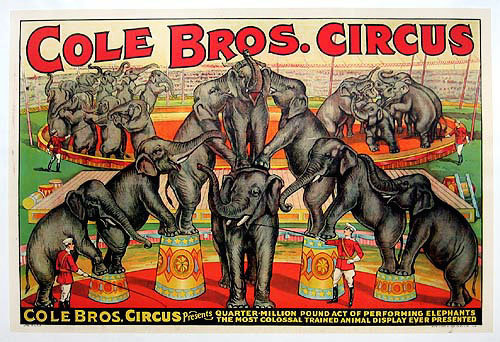
You are a GUI agent. You are given a task and a screenshot of the screen. Output one action in this format:
    pyautogui.click(x=<x>, y=<y>)
    Task: Click on the balancing stands
    The image size is (500, 342).
    Given the screenshot: What is the action you would take?
    pyautogui.click(x=399, y=292), pyautogui.click(x=317, y=279), pyautogui.click(x=195, y=274), pyautogui.click(x=103, y=293)